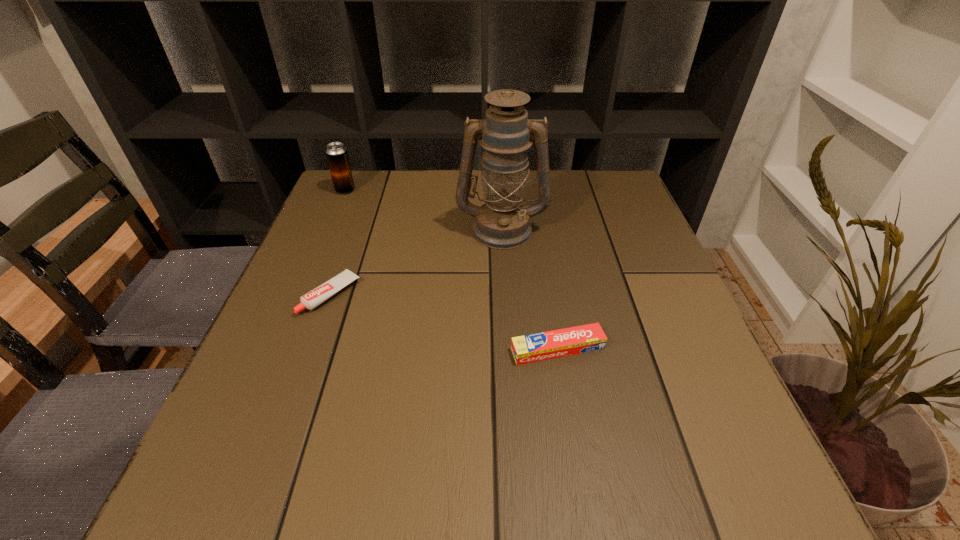
This screenshot has width=960, height=540. Identify the location of free space at the right edge. (702, 437).

The height and width of the screenshot is (540, 960). In the image, there is a desktop. Find the location of `free space at the far left corner`. free space at the far left corner is located at coordinates (327, 205).

The image size is (960, 540). Identify the location of vacant space at the far right corner of the desktop. (591, 212).

Locate an element on the screen. This screenshot has width=960, height=540. free area in between the farther toothpaste and the beer can is located at coordinates (338, 242).

This screenshot has height=540, width=960. Find the location of `vacant space in between the beer can and the nearest object`. vacant space in between the beer can and the nearest object is located at coordinates (451, 269).

Identify the location of blank region between the left toothpaste and the nearer toothpaste. (444, 322).

Where is `free space between the tallest object and the second nearest object`? The height and width of the screenshot is (540, 960). free space between the tallest object and the second nearest object is located at coordinates (417, 262).

At what (x,y) coordinates should I click in order to perform the action: click on vacant space in between the right toothpaste and the left toothpaste. Please return your answer as a coordinate pair (x, y). This screenshot has width=960, height=540. Looking at the image, I should click on (444, 322).

Find the location of a particular element. free space that is in between the oil lamp and the right toothpaste is located at coordinates (530, 289).

Where is `unoccupied position between the farther toothpaste and the nearest object`? This screenshot has width=960, height=540. unoccupied position between the farther toothpaste and the nearest object is located at coordinates (444, 322).